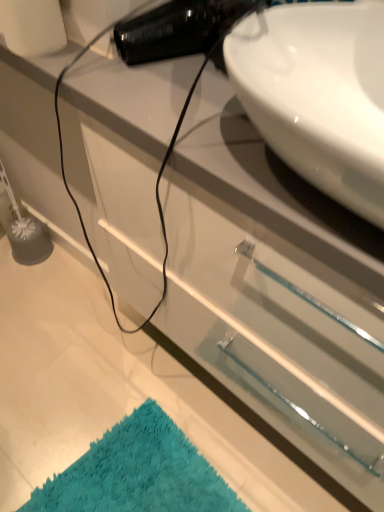
Image resolution: width=384 pixels, height=512 pixels. Identify the location of vacant point above teal shaggy bath mat at lower left (from a real-world perspective). (134, 479).